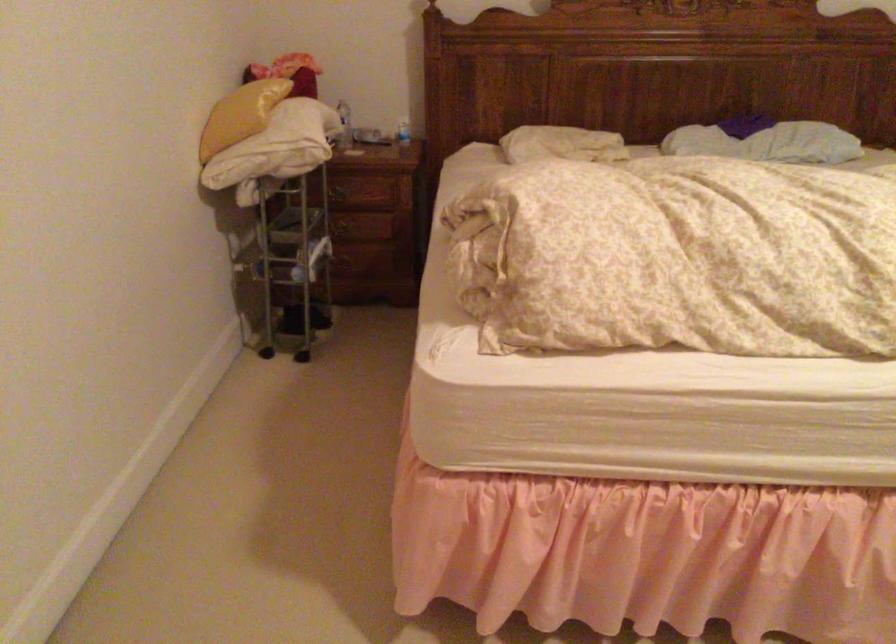
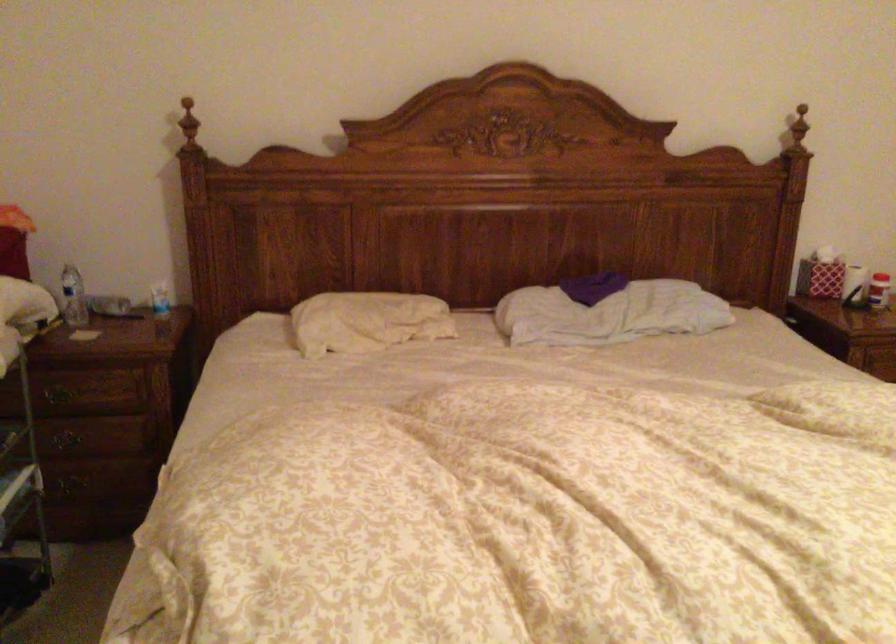
Question: The camera is either moving clockwise (left) or counter-clockwise (right) around the object. The first image is from the beginning of the video and the second image is from the end. Is the camera moving left or right when shooting the video?

Choices:
 (A) Left
 (B) Right

Answer: (A)